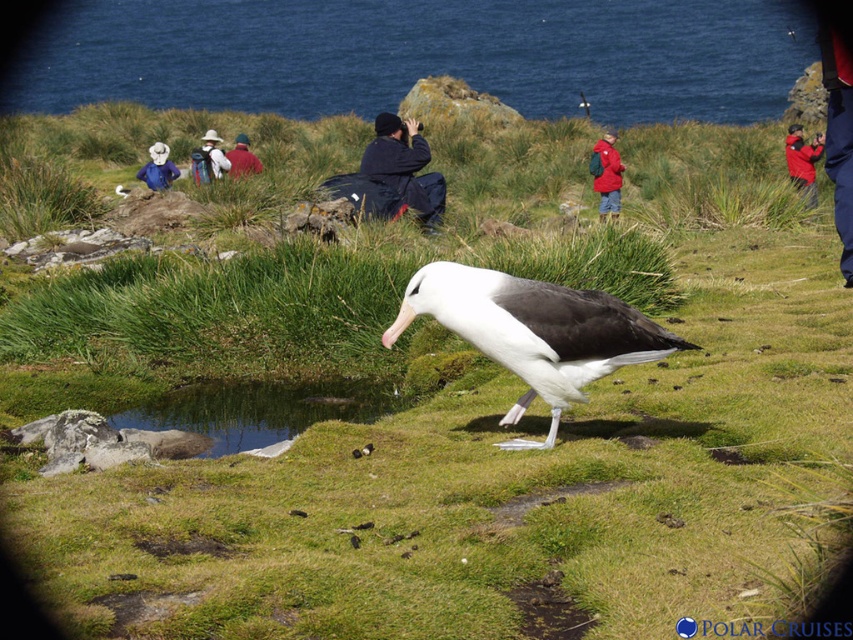
Does blue water at upper center have a smaller size compared to red fleece jacket at upper right?

No.

Can you confirm if blue water at upper center is bigger than red fleece jacket at upper right?

Yes, blue water at upper center is bigger than red fleece jacket at upper right.

Who is more forward, (619, 49) or (807, 202)?

Point (807, 202)

Where is `blue water at upper center`? blue water at upper center is located at coordinates (419, 54).

At what (x,y) coordinates should I click in order to perform the action: click on white matte mollymawk at center. Please return your answer as a coordinate pair (x, y). This screenshot has width=853, height=640. Looking at the image, I should click on (534, 332).

Is white matte mollymawk at center positioned at the back of dark blue jacket at center?

No, white matte mollymawk at center is closer to the viewer.

Find the location of `white matte mollymawk at center`. white matte mollymawk at center is located at coordinates (534, 332).

Image resolution: width=853 pixels, height=640 pixels. Find the location of `white matte mollymawk at center`. white matte mollymawk at center is located at coordinates (534, 332).

Is red fleece jacket at upper right smaller than white fabric hat at upper center?

Yes, red fleece jacket at upper right is smaller than white fabric hat at upper center.

Does red fleece jacket at upper right have a lesser height compared to white fabric hat at upper center?

Yes.

Is point (795, 163) positioned after point (207, 173)?

That is True.

Locate an element on the screen. The image size is (853, 640). red fleece jacket at upper right is located at coordinates (804, 161).